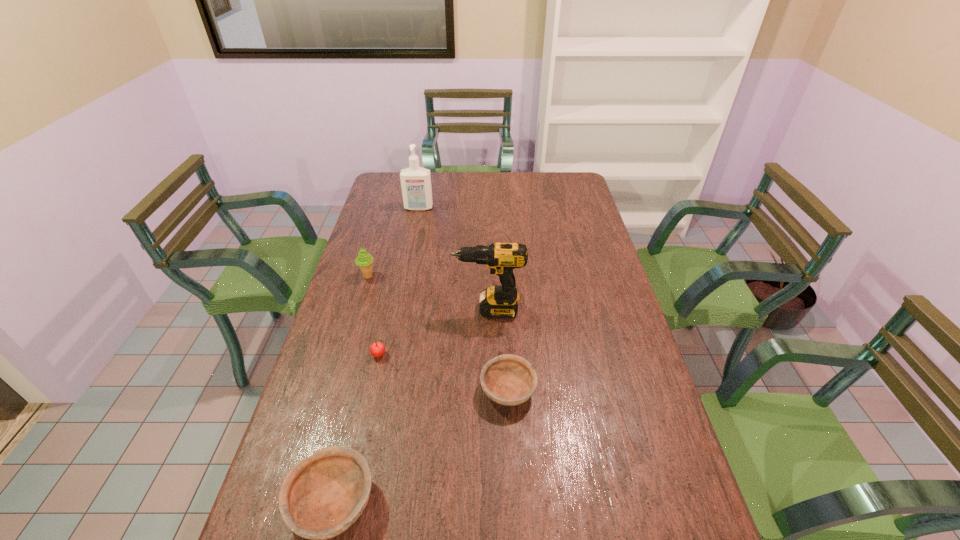
This screenshot has height=540, width=960. Find the location of `the shorter bowl`. the shorter bowl is located at coordinates (507, 379).

You are a GUI agent. You are given a task and a screenshot of the screen. Output one action in this format:
    pyautogui.click(x=<x>, y=<y>)
    Task: Click on the farther bowl
    The height and width of the screenshot is (540, 960).
    Given the screenshot: What is the action you would take?
    pyautogui.click(x=507, y=379)

Image resolution: width=960 pixels, height=540 pixels. I want to click on the farthest object, so click(x=415, y=181).

This screenshot has width=960, height=540. I want to click on icecream, so click(x=364, y=260).

Where is `the fourth shortest object`? Image resolution: width=960 pixels, height=540 pixels. the fourth shortest object is located at coordinates (364, 260).

This screenshot has width=960, height=540. In order to click on the third farthest object in this screenshot , I will do `click(496, 301)`.

I want to click on the third shortest object, so click(x=377, y=349).

You are a GUI agent. You are given a task and a screenshot of the screen. Output one action in this format:
    pyautogui.click(x=<x>, y=<y>)
    Task: Click on the fourth farthest object
    
    Given the screenshot: What is the action you would take?
    pyautogui.click(x=377, y=349)

Identify the location of vacant position located on the back of the farther bowl. (506, 354).

Where is `vacant space located on the front label of the farthest object`? vacant space located on the front label of the farthest object is located at coordinates (412, 244).